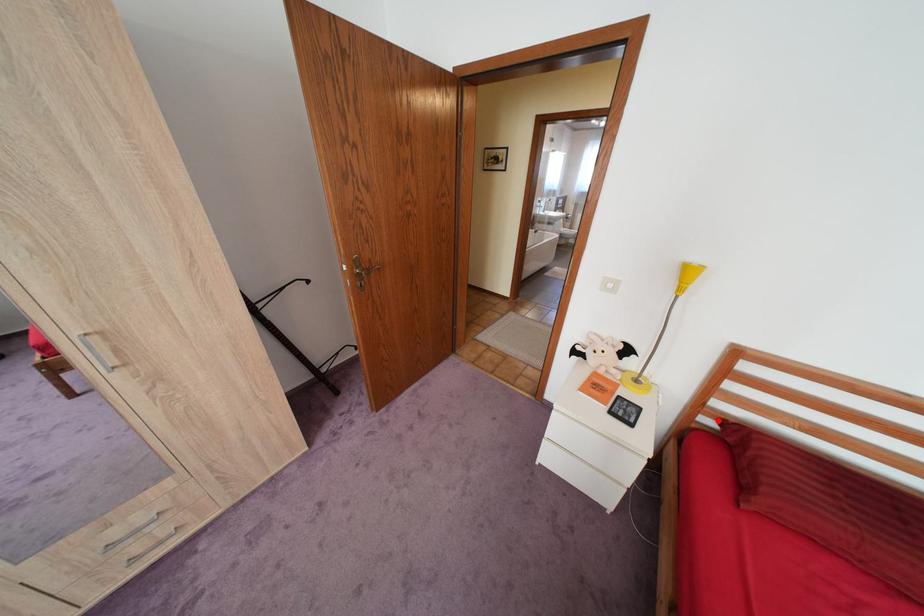
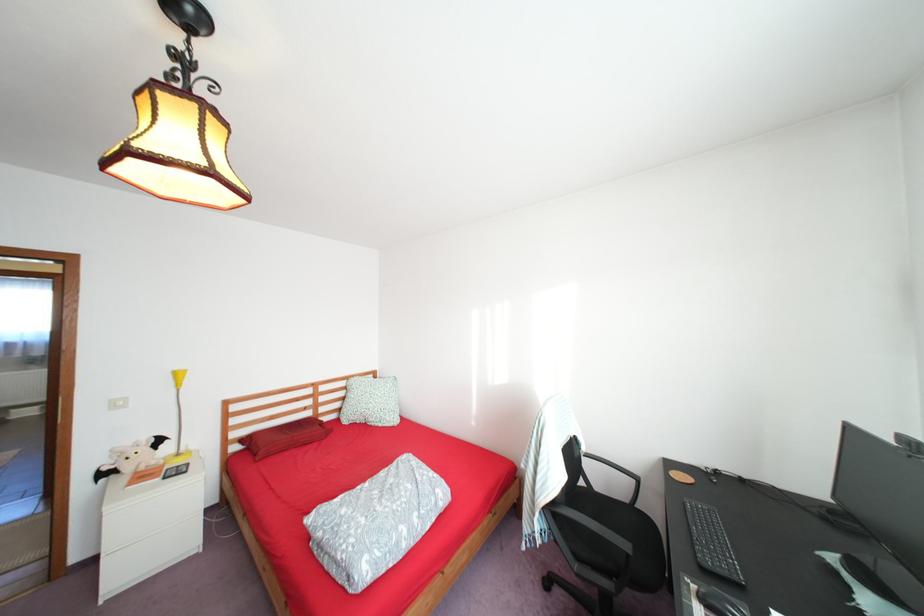
Find the pixel in the second image that matches the highlighted location in the first image.

(246, 447)